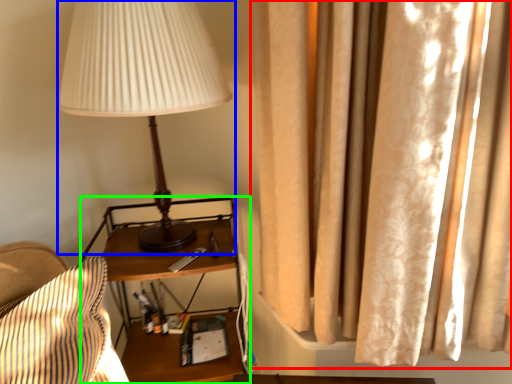
Question: Based on their relative distances, which object is farther from curtain (highlighted by a red box)? Choose from lamp (highlighted by a blue box) and nightstand (highlighted by a green box).

Choices:
 (A) lamp
 (B) nightstand

Answer: (B)